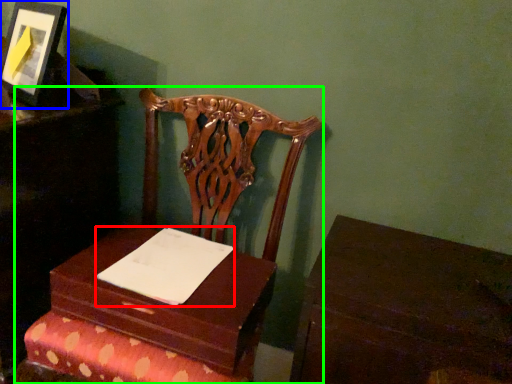
Question: Which is nearer to the notepad (highlighted by a red box)? picture frame (highlighted by a blue box) or furniture (highlighted by a green box).

Choices:
 (A) picture frame
 (B) furniture

Answer: (B)